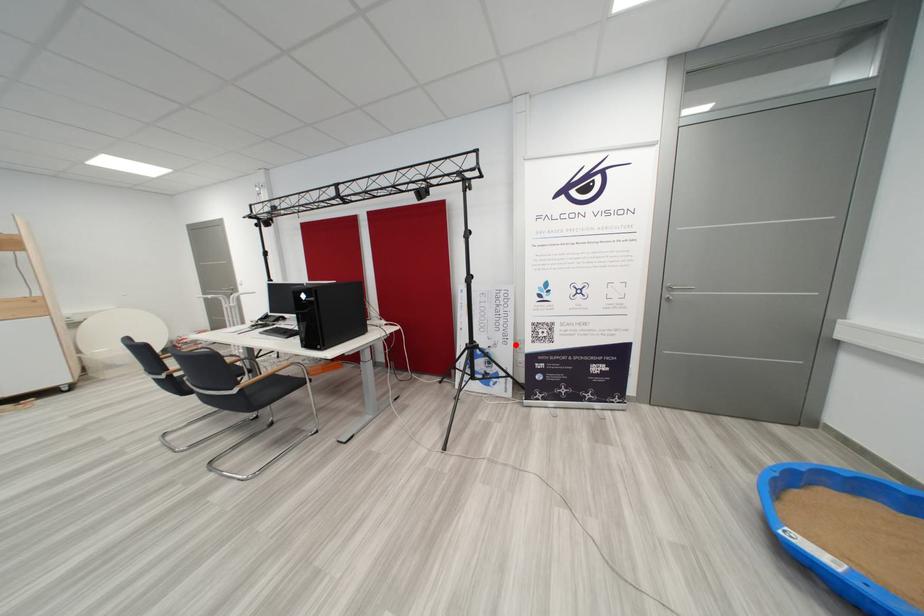
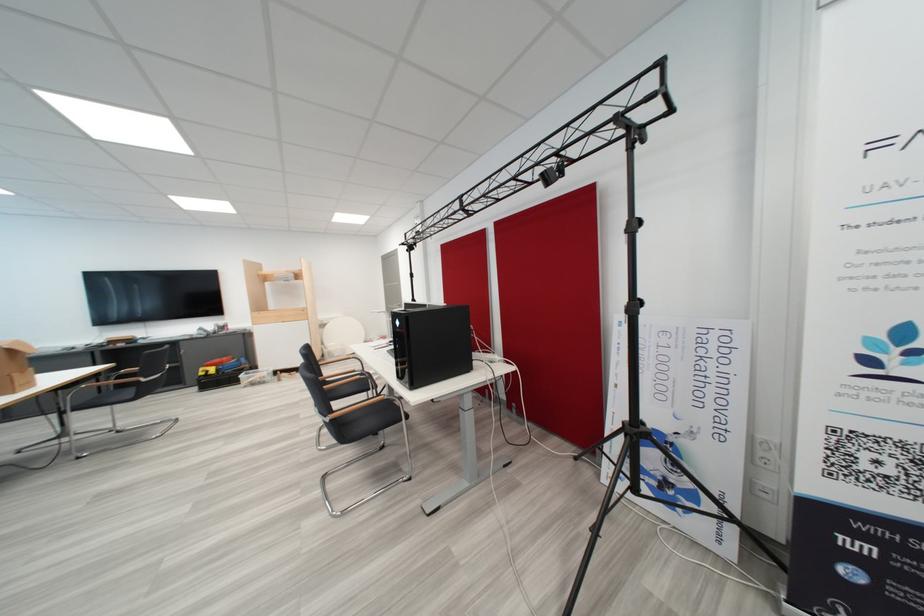
In the second image, find the point that corresponds to the highlighted location in the first image.

(731, 439)